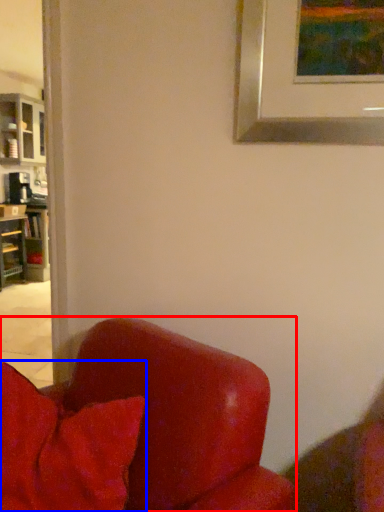
Question: Which object appears closest to the camera in this image, chair (highlighted by a red box) or pillow (highlighted by a blue box)?

Choices:
 (A) chair
 (B) pillow

Answer: (A)